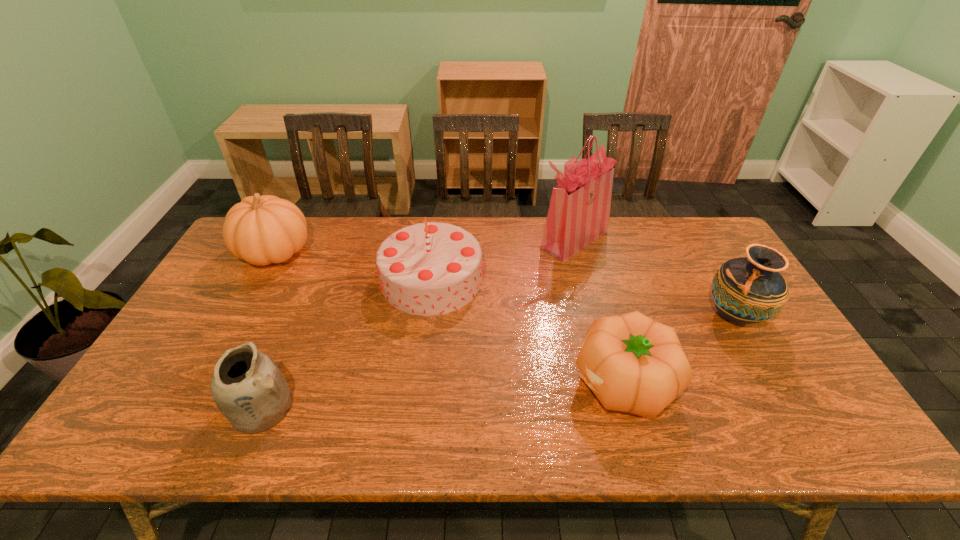
The image size is (960, 540). What are the coordinates of `shopping bag` in the screenshot? It's located at (579, 210).

At what (x,y) coordinates should I click in order to perform the action: click on the fourth object from right to left. Please return your answer as a coordinate pair (x, y). Looking at the image, I should click on (426, 269).

I want to click on the taller pumpkin, so click(261, 230).

In order to click on the farther pumpkin in this screenshot , I will do `click(261, 230)`.

Image resolution: width=960 pixels, height=540 pixels. I want to click on the taller pottery, so click(746, 290).

This screenshot has width=960, height=540. Identify the location of the rightmost object. (746, 290).

This screenshot has height=540, width=960. I want to click on the right pumpkin, so click(x=633, y=364).

The width and height of the screenshot is (960, 540). I want to click on the shorter pumpkin, so click(x=633, y=364).

You are a GUI agent. You are given a task and a screenshot of the screen. Output one action in this format:
    pyautogui.click(x=<x>, y=<y>)
    Task: Click on the shorter pottery
    Image resolution: width=960 pixels, height=540 pixels.
    Given the screenshot: What is the action you would take?
    pyautogui.click(x=249, y=389)

Identify the location of the nearer pottery. (249, 389).